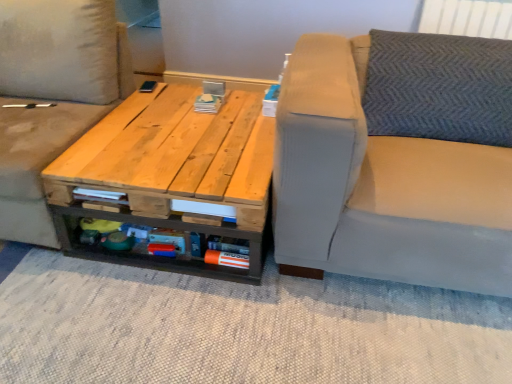
Question: Relative to light beige fabric studio couch at right, arranged as the 1th studio couch when viewed from the right, is light beige fabric studio couch at center, which is counted as the first studio couch, starting from the left, in front or behind?

Choices:
 (A) behind
 (B) front

Answer: (A)

Question: From a real-world perspective, relative to light beige fabric studio couch at right, which appears as the second studio couch when viewed from the left, is light beige fabric studio couch at center, which appears as the 2th studio couch when viewed from the right, vertically above or below?

Choices:
 (A) above
 (B) below

Answer: (A)

Question: Which is farther from the light beige fabric studio couch at center, which is counted as the first studio couch, starting from the left?

Choices:
 (A) light beige fabric studio couch at right, arranged as the 1th studio couch when viewed from the right
 (B) natural wood table at center

Answer: (A)

Question: Estimate the real-world distances between objects in this image. Which object is farther from the light beige fabric studio couch at right, arranged as the 1th studio couch when viewed from the right?

Choices:
 (A) natural wood table at center
 (B) light beige fabric studio couch at center, which appears as the 2th studio couch when viewed from the right

Answer: (B)